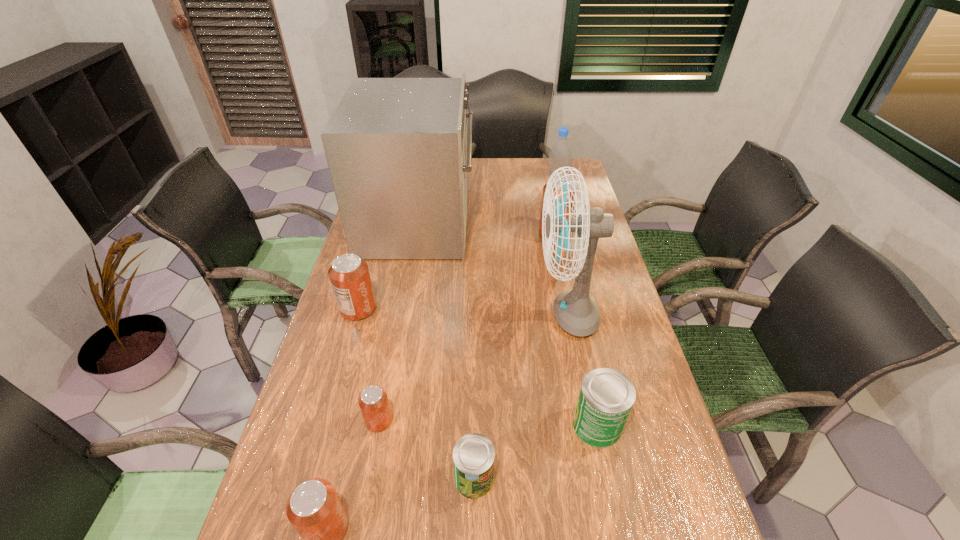
Where is `object that is the third closest to the bottle`? Image resolution: width=960 pixels, height=540 pixels. object that is the third closest to the bottle is located at coordinates (576, 312).

Locate an element on the screen. The image size is (960, 540). can that is the second nearest to the rightmost orange can is located at coordinates (606, 397).

The width and height of the screenshot is (960, 540). In order to click on can that stands as the fifth closest to the third farthest orange can in this screenshot , I will do `click(568, 177)`.

This screenshot has width=960, height=540. I want to click on orange can that is the third closest to the bigger green can, so click(349, 275).

Select which orange can appears as the third closest to the biggest orange can. Please provide its 2D coordinates. Your answer should be formatted as a tuple, i.e. [(x, y)], where the tuple contains the x and y coordinates of a point satisfying the conditions above.

[(314, 509)]

Locate an element on the screen. Image resolution: width=960 pixels, height=540 pixels. free space that satisfies the following two spatial constraints: 1. on the back side of the left green can; 2. on the right side of the rightmost orange can is located at coordinates (476, 235).

Find the location of `free space in the image that satisfies the following two spatial constraints: 1. on the front side of the third nearest orange can; 2. on the right side of the right green can`. free space in the image that satisfies the following two spatial constraints: 1. on the front side of the third nearest orange can; 2. on the right side of the right green can is located at coordinates (325, 425).

Where is `vacant region that satisfies the following two spatial constraints: 1. on the front-facing side of the fan; 2. on the front side of the smallest orange can`? The image size is (960, 540). vacant region that satisfies the following two spatial constraints: 1. on the front-facing side of the fan; 2. on the front side of the smallest orange can is located at coordinates (588, 421).

Find the location of a particular element. The width and height of the screenshot is (960, 540). free spot that satisfies the following two spatial constraints: 1. on the front panel of the toaster oven; 2. on the left side of the farthest can is located at coordinates (417, 235).

Find the location of a particular element. blank space that satisfies the following two spatial constraints: 1. on the front panel of the toaster oven; 2. on the right side of the right green can is located at coordinates (383, 425).